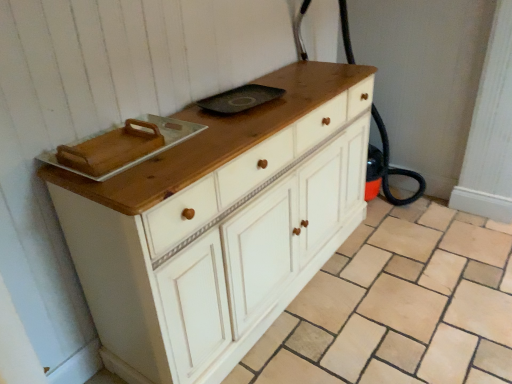
You are a GUI agent. You are given a task and a screenshot of the screen. Output one action in this format:
    pyautogui.click(x=<x>, y=<y>)
    Task: Click on the white wood cabinet at center
    
    Given the screenshot: What is the action you would take?
    pyautogui.click(x=398, y=306)

What do you see at coordinates (398, 306) in the screenshot?
I see `white wood cabinet at center` at bounding box center [398, 306].

Describe the element at coordinates (219, 225) in the screenshot. I see `white wood chest of drawers at center` at that location.

You are a GUI agent. You are given a task and a screenshot of the screen. Output one action in this format:
    pyautogui.click(x=<x>, y=<y>)
    Task: Click on the white wood chest of drawers at center
    This screenshot has width=512, height=384.
    Given the screenshot: What is the action you would take?
    pyautogui.click(x=219, y=225)

The width and height of the screenshot is (512, 384). I want to click on white wood cabinet at center, so click(x=398, y=306).

Between white wood cabinet at center and white wood chest of drawers at center, which one appears on the right side from the viewer's perspective?

white wood cabinet at center is more to the right.

Does white wood cabinet at center come in front of white wood chest of drawers at center?

Yes, white wood cabinet at center is closer to the viewer.

Considering the positions of points (502, 241) and (108, 299), is point (502, 241) farther from camera compared to point (108, 299)?

Yes.

From the image's perspective, does white wood cabinet at center appear higher than white wood chest of drawers at center?

No, from the image's perspective, white wood cabinet at center is not over white wood chest of drawers at center.

From a real-world perspective, is white wood cabinet at center physically below white wood chest of drawers at center?

Yes, from a real-world perspective, white wood cabinet at center is below white wood chest of drawers at center.

Considering the sizes of objects white wood cabinet at center and white wood chest of drawers at center in the image provided, who is thinner, white wood cabinet at center or white wood chest of drawers at center?

With smaller width is white wood chest of drawers at center.

Is white wood cabinet at center taller than white wood chest of drawers at center?

In fact, white wood cabinet at center may be shorter than white wood chest of drawers at center.

Consider the image. Which of these two, white wood cabinet at center or white wood chest of drawers at center, is smaller?

white wood cabinet at center.

Looking at this image, is white wood cabinet at center inside or outside of white wood chest of drawers at center?

white wood cabinet at center is located beyond the bounds of white wood chest of drawers at center.

Is white wood cabinet at center touching white wood chest of drawers at center?

No, white wood cabinet at center is not touching white wood chest of drawers at center.

Could you tell me if white wood cabinet at center is turned towards white wood chest of drawers at center?

Yes, white wood cabinet at center is aimed at white wood chest of drawers at center.

This screenshot has height=384, width=512. Find the location of `chest of drawers above the white wood cabinet at center (from a real-world perspective)`. chest of drawers above the white wood cabinet at center (from a real-world perspective) is located at coordinates (219, 225).

Can you confirm if white wood chest of drawers at center is positioned to the right of white wood cabinet at center?

In fact, white wood chest of drawers at center is to the left of white wood cabinet at center.

Is the position of white wood chest of drawers at center more distant than that of white wood cabinet at center?

That is True.

Does point (343, 223) appear closer or farther from the camera than point (304, 347)?

Point (343, 223) is positioned farther from the camera compared to point (304, 347).

From the image's perspective, would you say white wood chest of drawers at center is shown under white wood cabinet at center?

No.

From a real-world perspective, does white wood chest of drawers at center sit lower than white wood cabinet at center?

No, from a real-world perspective, white wood chest of drawers at center is not under white wood cabinet at center.

Considering the sizes of objects white wood chest of drawers at center and white wood cabinet at center in the image provided, who is thinner, white wood chest of drawers at center or white wood cabinet at center?

Thinner between the two is white wood chest of drawers at center.

In terms of height, does white wood chest of drawers at center look taller or shorter compared to white wood cabinet at center?

white wood chest of drawers at center is taller than white wood cabinet at center.

Between white wood chest of drawers at center and white wood cabinet at center, which one has smaller size?

white wood cabinet at center.

Is white wood cabinet at center located within white wood chest of drawers at center?

No.

Is white wood chest of drawers at center not close to white wood cabinet at center?

Actually, white wood chest of drawers at center and white wood cabinet at center are a little close together.

Looking at this image, is white wood chest of drawers at center oriented away from white wood cabinet at center?

That's not correct — white wood chest of drawers at center is not looking away from white wood cabinet at center.

Find the location of a particular element. chest of drawers above the white wood cabinet at center (from a real-world perspective) is located at coordinates (219, 225).

This screenshot has height=384, width=512. What are the coordinates of `chest of drawers above the white wood cabinet at center (from the image's perspective)` in the screenshot? It's located at (219, 225).

You are a GUI agent. You are given a task and a screenshot of the screen. Output one action in this format:
    pyautogui.click(x=<x>, y=<y>)
    Task: Click on the tile in front of the white wood chest of drawers at center
    The width and height of the screenshot is (512, 384).
    Given the screenshot: What is the action you would take?
    pyautogui.click(x=398, y=306)